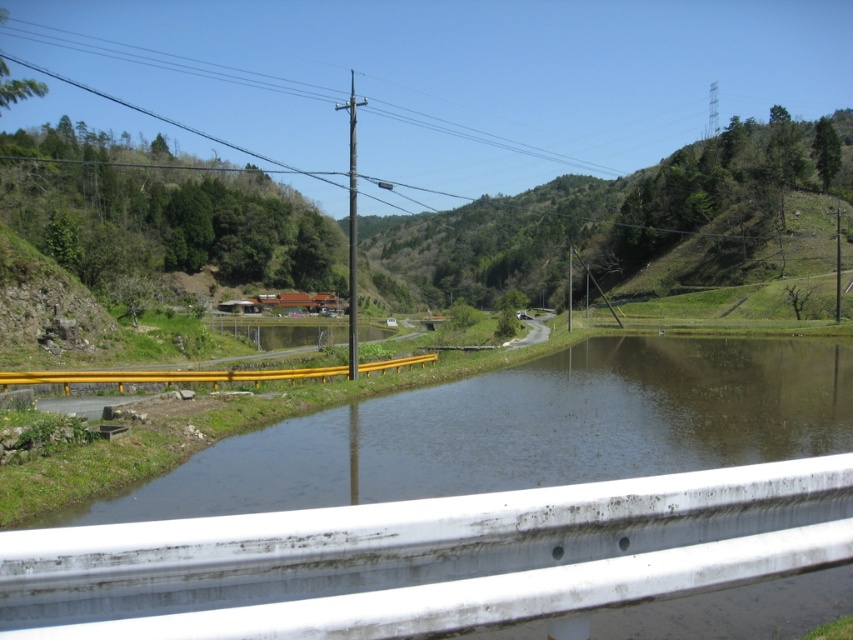
Question: Is clear water at lower left behind green grassy hillside at center?

Choices:
 (A) yes
 (B) no

Answer: (B)

Question: Which object appears farthest from the camera in this image?

Choices:
 (A) clear water at lower left
 (B) green grassy hillside at center

Answer: (B)

Question: Does clear water at lower left appear over green grassy hillside at center?

Choices:
 (A) no
 (B) yes

Answer: (A)

Question: Does clear water at lower left have a smaller size compared to green grassy hillside at center?

Choices:
 (A) no
 (B) yes

Answer: (B)